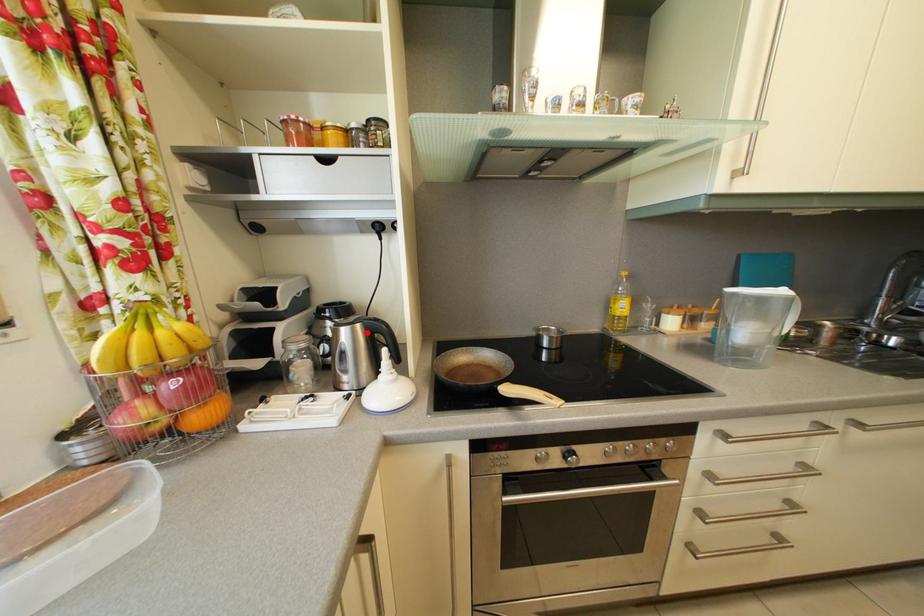
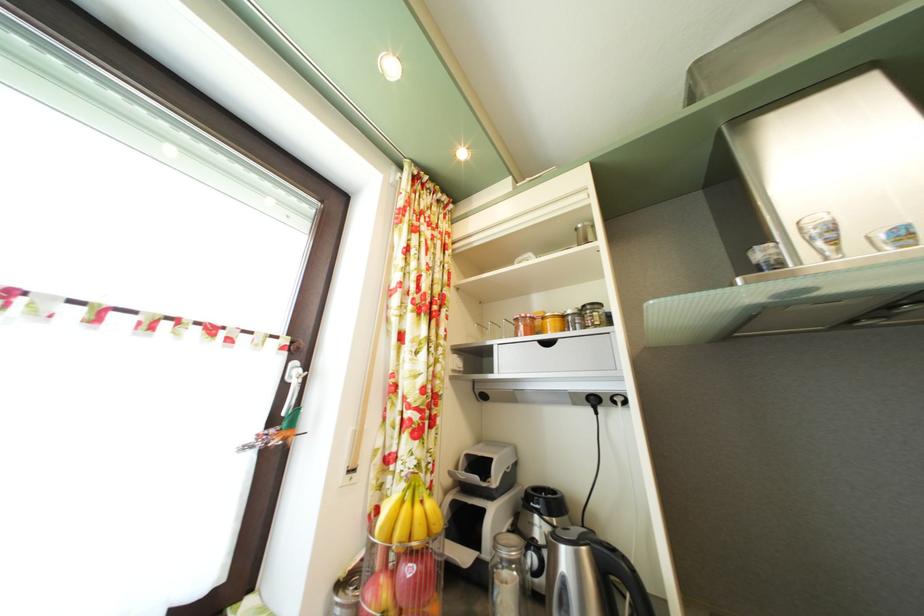
Locate, in the second image, the point that corresponds to the highlighted location in the first image.

(592, 556)